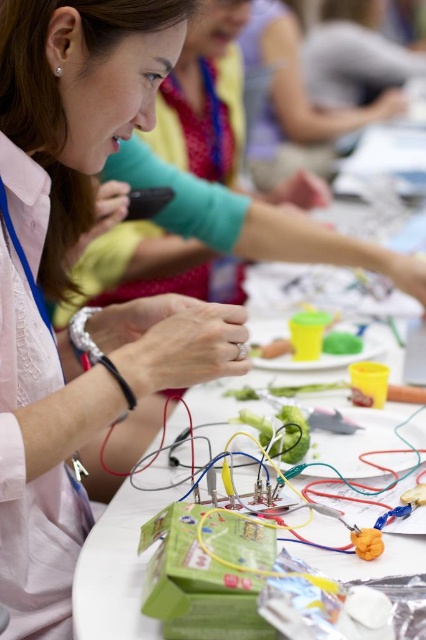
Question: Which point is closer to the camera?

Choices:
 (A) white paper at center
 (B) matte green shirt at upper center

Answer: (A)

Question: Is matte pink shirt at center positioned in front of matte green shirt at upper center?

Choices:
 (A) no
 (B) yes

Answer: (B)

Question: Can you confirm if matte pink shirt at center is positioned below matte green shirt at upper center?

Choices:
 (A) yes
 (B) no

Answer: (A)

Question: Which object appears closest to the camera in this image?

Choices:
 (A) matte pink shirt at center
 (B) white paper at center

Answer: (A)

Question: Does matte pink shirt at center appear on the left side of matte green shirt at upper center?

Choices:
 (A) yes
 (B) no

Answer: (A)

Question: Considering the real-world distances, which object is closest to the matte pink shirt at center?

Choices:
 (A) matte green shirt at upper center
 (B) white paper at center

Answer: (B)